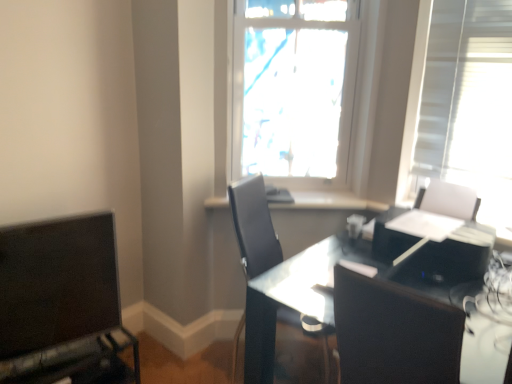
Where is `blank area beneath transparent glass window at center (from a real-world perspective)`? Image resolution: width=512 pixels, height=384 pixels. blank area beneath transparent glass window at center (from a real-world perspective) is located at coordinates (310, 190).